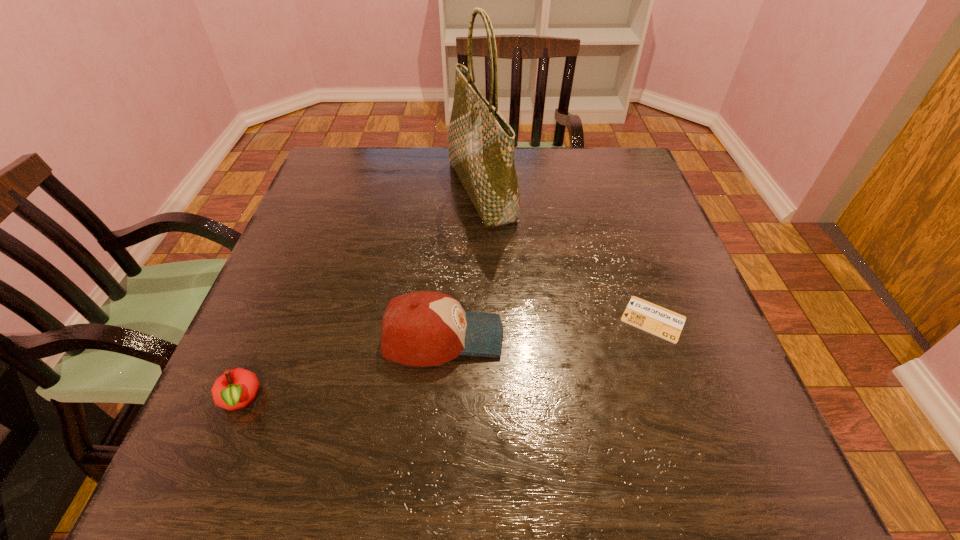
This screenshot has height=540, width=960. I want to click on free region located on the front of the identity card, so click(697, 445).

At what (x,y) coordinates should I click in order to perform the action: click on object that is at the far edge. Please return your answer as a coordinate pair (x, y). The image size is (960, 540). Looking at the image, I should click on (481, 143).

Where is `object that is at the left edge`? object that is at the left edge is located at coordinates (235, 389).

Where is `object located at the right edge`? object located at the right edge is located at coordinates (666, 324).

Locate an element on the screen. Image resolution: width=960 pixels, height=540 pixels. vacant region at the far edge of the desktop is located at coordinates (535, 163).

I want to click on free space at the near edge of the desktop, so tap(439, 459).

In the image, there is a desktop. Where is `vacant space at the left edge`? This screenshot has width=960, height=540. vacant space at the left edge is located at coordinates (301, 238).

In order to click on vacant area at the right edge of the desktop in this screenshot , I will do `click(640, 355)`.

In the image, there is a desktop. Where is `blank space at the far left corner`? This screenshot has width=960, height=540. blank space at the far left corner is located at coordinates (356, 157).

In the image, there is a desktop. Find the location of `vacant space at the near left corner`. vacant space at the near left corner is located at coordinates (287, 458).